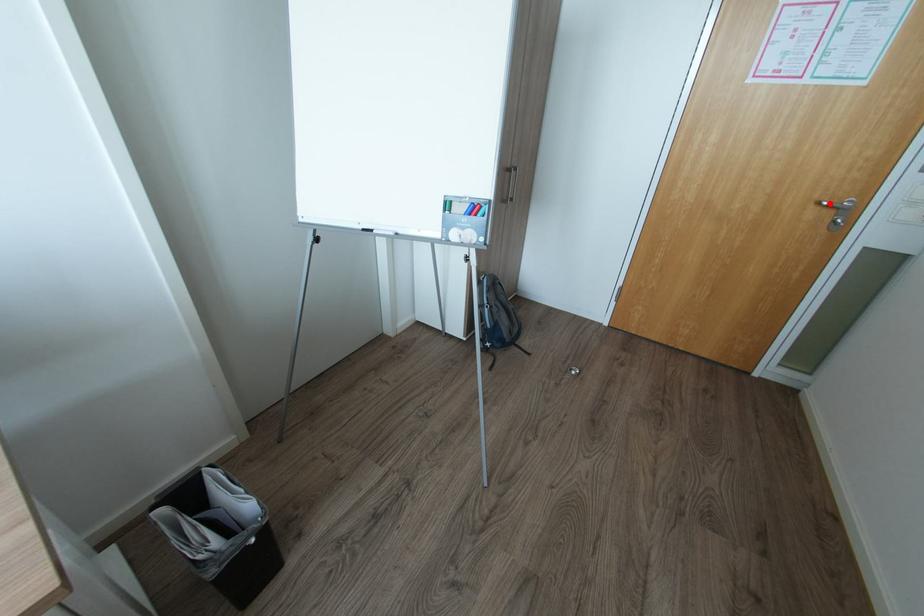
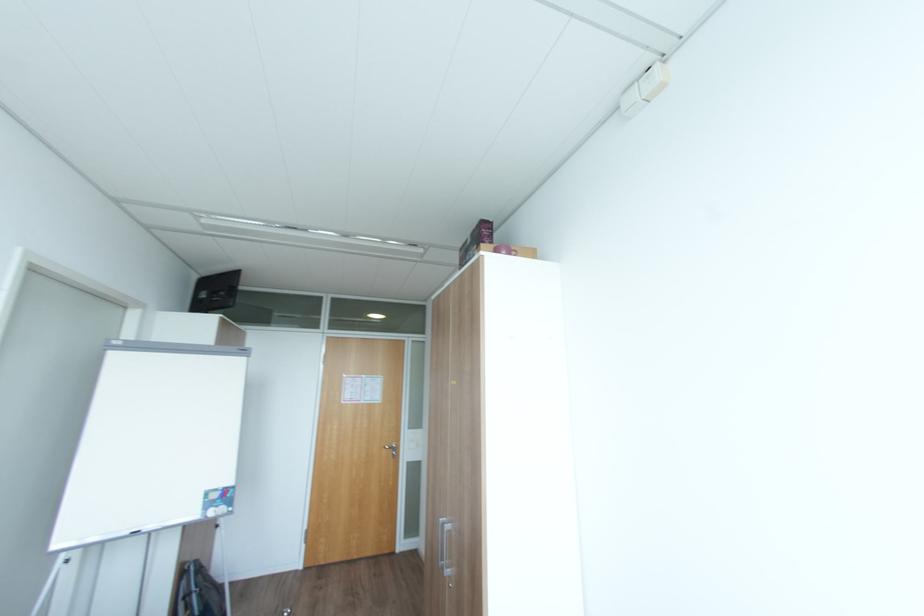
Find the pixel in the second image that matches the highlighted location in the first image.

(392, 448)